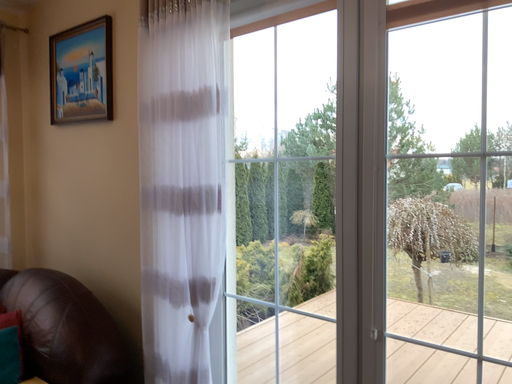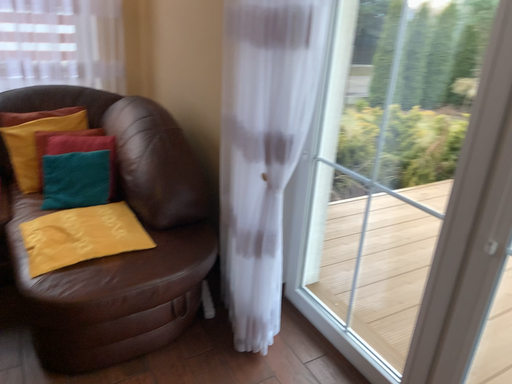
Question: How did the camera likely rotate when shooting the video?

Choices:
 (A) rotated left
 (B) rotated right

Answer: (A)